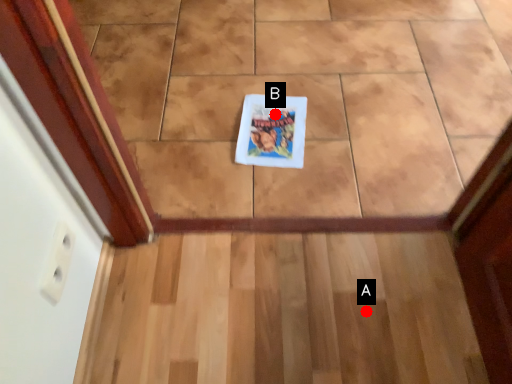
Question: Two points are circled on the image, labeled by A and B beside each circle. Which of the following is the closest to the observer?

Choices:
 (A) A is closer
 (B) B is closer

Answer: (A)